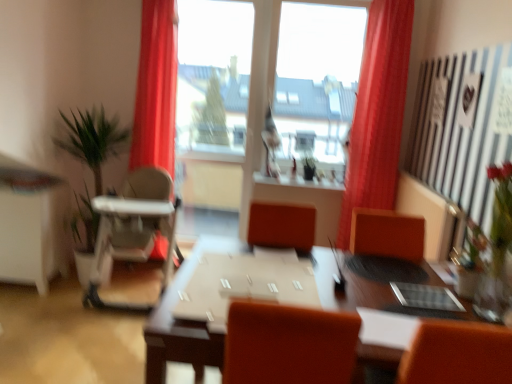
This screenshot has height=384, width=512. Find the location of `vacant area that is in front of white glossy computer desk at left`. vacant area that is in front of white glossy computer desk at left is located at coordinates (20, 304).